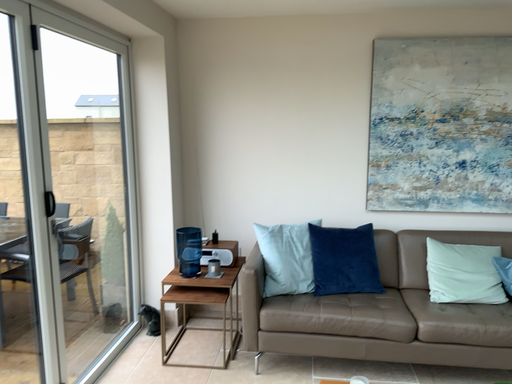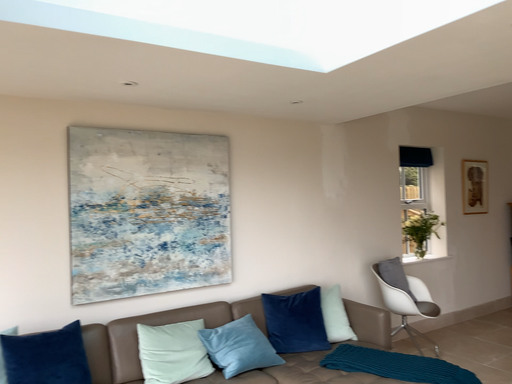
Question: Which way did the camera rotate in the video?

Choices:
 (A) rotated downward
 (B) rotated upward

Answer: (B)